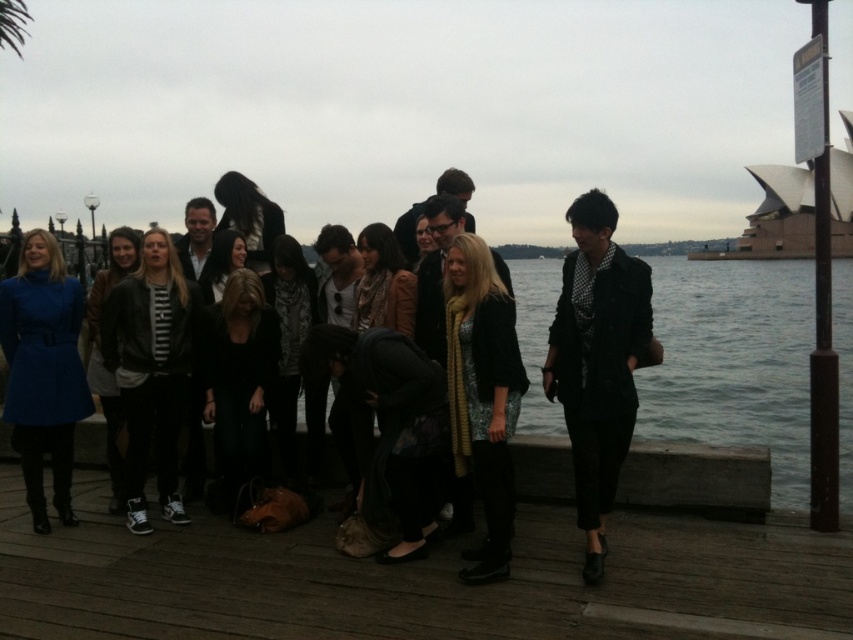
Does shiny gold scarf at center appear over matte blue coat at lower left?

Incorrect, shiny gold scarf at center is not positioned above matte blue coat at lower left.

Where is `shiny gold scarf at center`? The width and height of the screenshot is (853, 640). shiny gold scarf at center is located at coordinates (482, 394).

Describe the element at coordinates (482, 394) in the screenshot. I see `shiny gold scarf at center` at that location.

Locate an element on the screen. This screenshot has width=853, height=640. shiny gold scarf at center is located at coordinates (482, 394).

Can you confirm if wooden dock at center is smaller than shiny gold scarf at center?

No, wooden dock at center is not smaller than shiny gold scarf at center.

Is wooden dock at center above shiny gold scarf at center?

No, wooden dock at center is not above shiny gold scarf at center.

Is point (775, 588) less distant than point (491, 300)?

Yes, point (775, 588) is closer to viewer.

Where is `wooden dock at center`? wooden dock at center is located at coordinates (415, 580).

Between wooden dock at center and matte blue coat at lower left, which one appears on the left side from the viewer's perspective?

From the viewer's perspective, matte blue coat at lower left appears more on the left side.

Based on the photo, which of these two, wooden dock at center or matte blue coat at lower left, stands shorter?

wooden dock at center

What do you see at coordinates (415, 580) in the screenshot?
I see `wooden dock at center` at bounding box center [415, 580].

Where is `wooden dock at center`? wooden dock at center is located at coordinates (415, 580).